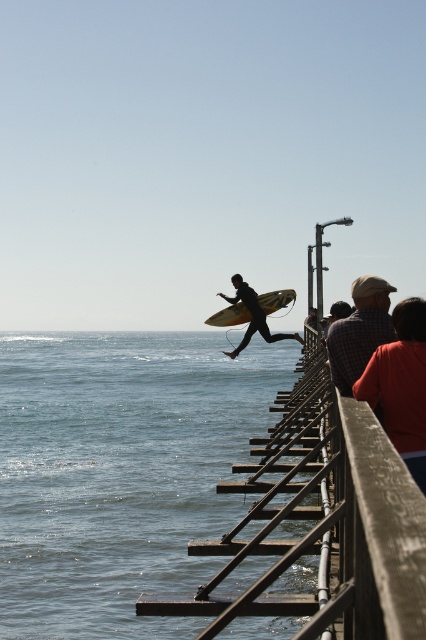
You are a photographer trying to capture the scene of the person jumping off the pier. You notice the clear blue water at lower left and the plaid shirt at center. Which object is taller in the image?

The clear blue water at lower left is taller than the plaid shirt at center.